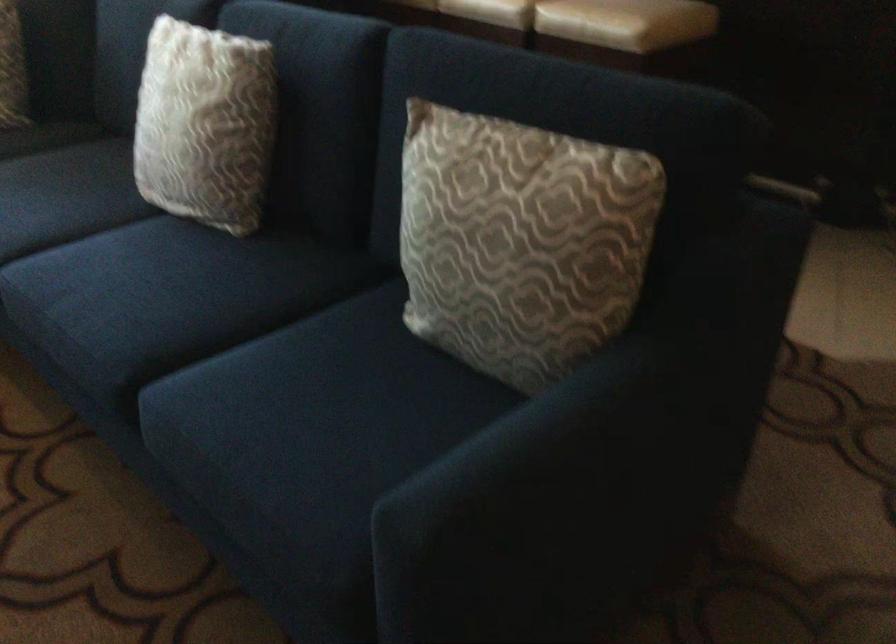
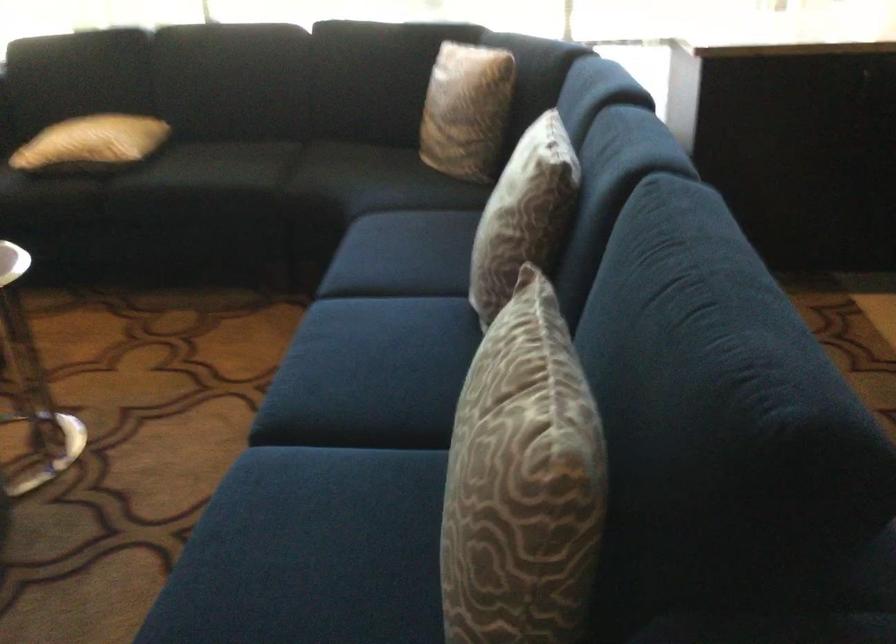
The point at (240, 355) is marked in the first image. Where is the corresponding point in the second image?

(341, 458)